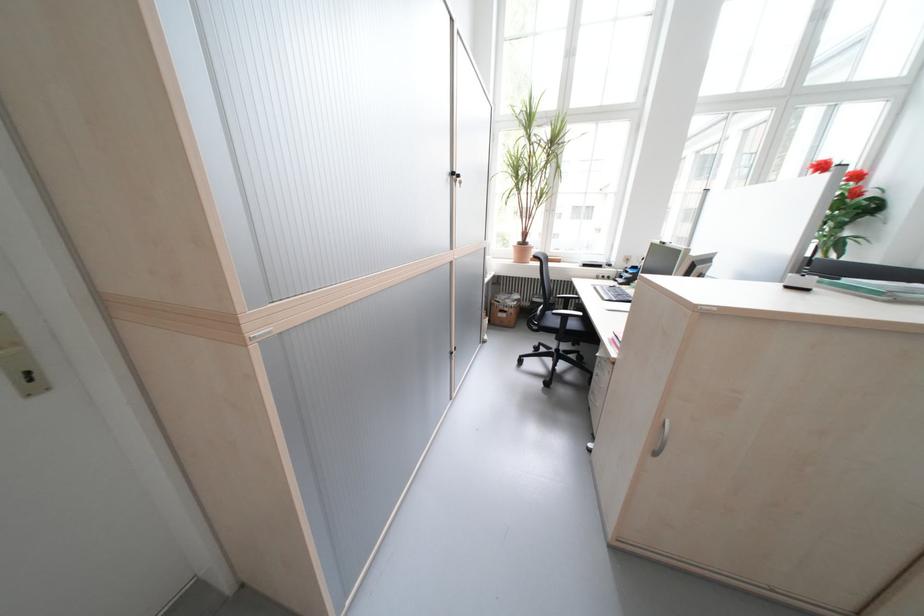
Where is `telephone handset`? telephone handset is located at coordinates (627, 275).